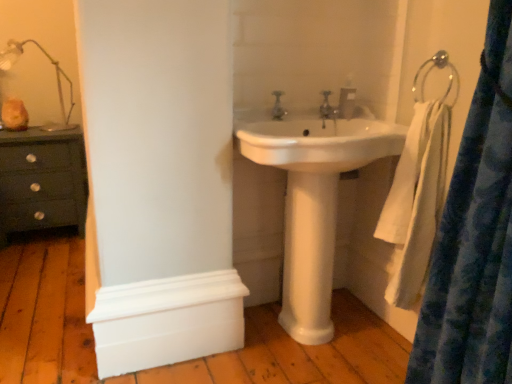
Question: Is white glossy pedestal at center behind metallic silver towel ring at upper right?

Choices:
 (A) yes
 (B) no

Answer: (A)

Question: Is white glossy pedestal at center shorter than metallic silver towel ring at upper right?

Choices:
 (A) no
 (B) yes

Answer: (A)

Question: Is white glossy pedestal at center smaller than metallic silver towel ring at upper right?

Choices:
 (A) no
 (B) yes

Answer: (A)

Question: Are white glossy pedestal at center and metallic silver towel ring at upper right located far from each other?

Choices:
 (A) no
 (B) yes

Answer: (A)

Question: Is the depth of white glossy pedestal at center less than that of metallic silver towel ring at upper right?

Choices:
 (A) yes
 (B) no

Answer: (B)

Question: Visually, is translucent glass lamp at upper left positioned to the left or to the right of silver metallic faucet at center, positioned as the first tap in right-to-left order?

Choices:
 (A) left
 (B) right

Answer: (A)

Question: Is translucent glass lamp at upper left spatially inside silver metallic faucet at center, marked as the second tap in a front-to-back arrangement, or outside of it?

Choices:
 (A) outside
 (B) inside

Answer: (A)

Question: Considering their positions, is translucent glass lamp at upper left located in front of or behind silver metallic faucet at center, positioned as the first tap in right-to-left order?

Choices:
 (A) behind
 (B) front

Answer: (A)

Question: In terms of height, does translucent glass lamp at upper left look taller or shorter compared to silver metallic faucet at center, marked as the second tap in a front-to-back arrangement?

Choices:
 (A) tall
 (B) short

Answer: (A)

Question: Considering the positions of white glossy pedestal at center and translucent glass lamp at upper left in the image, is white glossy pedestal at center bigger or smaller than translucent glass lamp at upper left?

Choices:
 (A) small
 (B) big

Answer: (A)

Question: In terms of height, does white glossy pedestal at center look taller or shorter compared to translucent glass lamp at upper left?

Choices:
 (A) tall
 (B) short

Answer: (A)

Question: From a real-world perspective, is white glossy pedestal at center physically located above or below translucent glass lamp at upper left?

Choices:
 (A) below
 (B) above

Answer: (A)

Question: Is white glossy pedestal at center in front of or behind translucent glass lamp at upper left in the image?

Choices:
 (A) front
 (B) behind

Answer: (A)

Question: Is matte silver faucet at center, the second tap positioned from the back, to the left or to the right of silver metallic faucet at center, positioned as the first tap in right-to-left order, in the image?

Choices:
 (A) left
 (B) right

Answer: (A)

Question: Is matte silver faucet at center, positioned as the 1th tap in front-to-back order, situated inside silver metallic faucet at center, acting as the first tap starting from the back, or outside?

Choices:
 (A) outside
 (B) inside

Answer: (A)